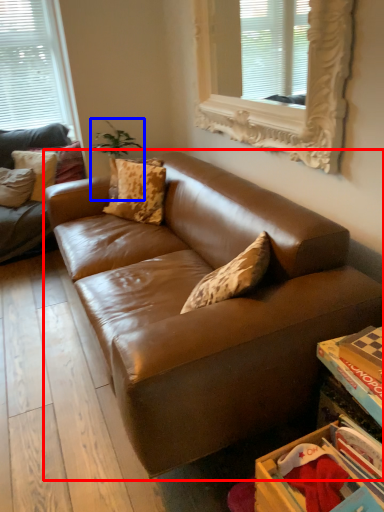
Question: Which of the following is the farthest to the observer, studio couch (highlighted by a red box) or plant (highlighted by a blue box)?

Choices:
 (A) studio couch
 (B) plant

Answer: (B)